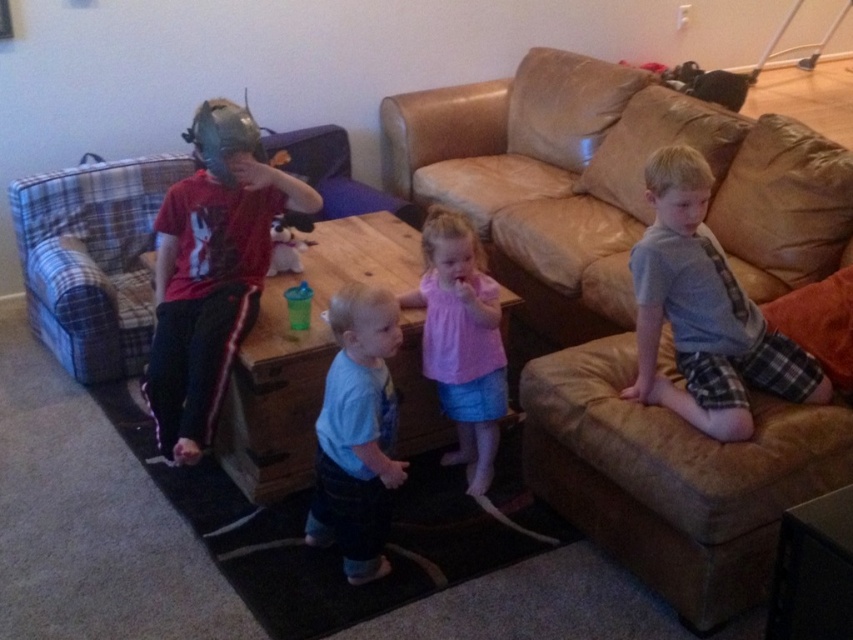
You are a photographer setting up for a group photo in the living room. You need to position the brown leather couch at upper right and the gray flannel shirt at right so that they are both visible in the frame. Considering their heights, which object should be placed closer to the back of the frame to ensure both are fully visible?

The brown leather couch at upper right is taller than the gray flannel shirt at right, so it should be placed closer to the back of the frame to ensure both are fully visible.